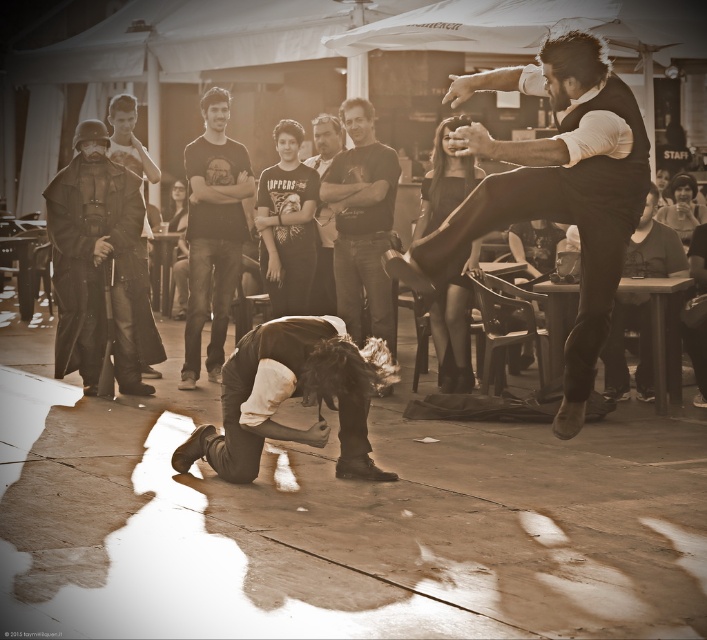
Is the position of smooth black dress at center less distant than that of dark gray shirt at center?

That is True.

At what (x,y) coordinates should I click in order to perform the action: click on smooth black dress at center. Please return your answer as a coordinate pair (x, y). The height and width of the screenshot is (640, 707). Looking at the image, I should click on (452, 326).

Is dark matte costume at left to the left of dark gray shirt at center from the viewer's perspective?

Correct, you'll find dark matte costume at left to the left of dark gray shirt at center.

What do you see at coordinates (99, 266) in the screenshot?
I see `dark matte costume at left` at bounding box center [99, 266].

Between point (103, 339) and point (332, 298), which one is positioned in front?

Point (103, 339)

Identify the location of dark matte costume at left. This screenshot has height=640, width=707. pyautogui.click(x=99, y=266).

Looking at this image, can you confirm if dark cotton shirt at center is positioned above dark hair at center?

Incorrect, dark cotton shirt at center is not positioned above dark hair at center.

Is dark cotton shirt at center closer to the viewer compared to dark hair at center?

Yes, dark cotton shirt at center is in front of dark hair at center.

Is point (344, 273) closer to camera compared to point (175, 284)?

Yes, it is in front of point (175, 284).

Find the location of a particular element. This screenshot has width=707, height=640. dark cotton shirt at center is located at coordinates (362, 224).